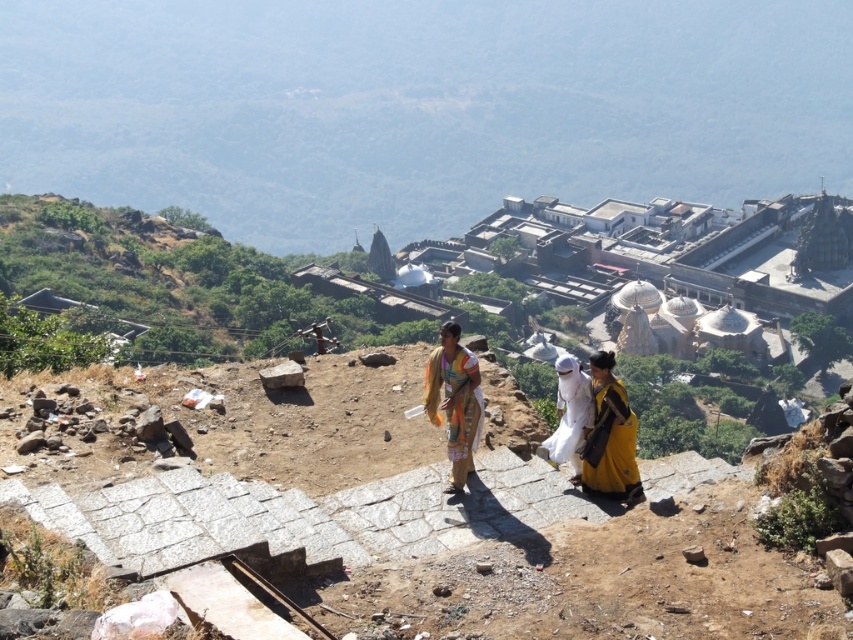
Can you confirm if yellow fabric dress at lower right is wider than white cotton dress at center?

No.

I want to click on yellow fabric dress at lower right, so click(608, 435).

Describe the element at coordinates (608, 435) in the screenshot. I see `yellow fabric dress at lower right` at that location.

Locate an element on the screen. yellow fabric dress at lower right is located at coordinates (608, 435).

Who is positioned more to the left, yellow fabric dress at lower right or multicolored fabric at center?

From the viewer's perspective, multicolored fabric at center appears more on the left side.

Is yellow fabric dress at lower right positioned in front of multicolored fabric at center?

No.

Does point (593, 472) lie in front of point (428, 376)?

Yes.

Locate an element on the screen. The image size is (853, 640). yellow fabric dress at lower right is located at coordinates (608, 435).

Is multicolored fabric at center smaller than white cotton dress at center?

Yes, multicolored fabric at center is smaller than white cotton dress at center.

Who is more distant from viewer, (466, 420) or (567, 451)?

Positioned behind is point (567, 451).

Is point (471, 355) positioned in front of point (563, 365)?

Yes, it is.

Locate an element on the screen. Image resolution: width=853 pixels, height=640 pixels. multicolored fabric at center is located at coordinates (454, 401).